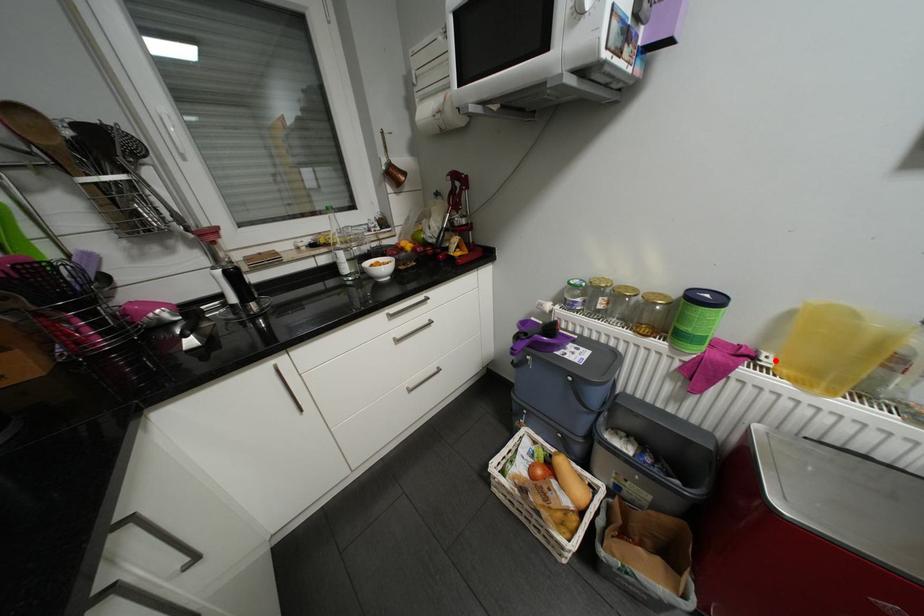
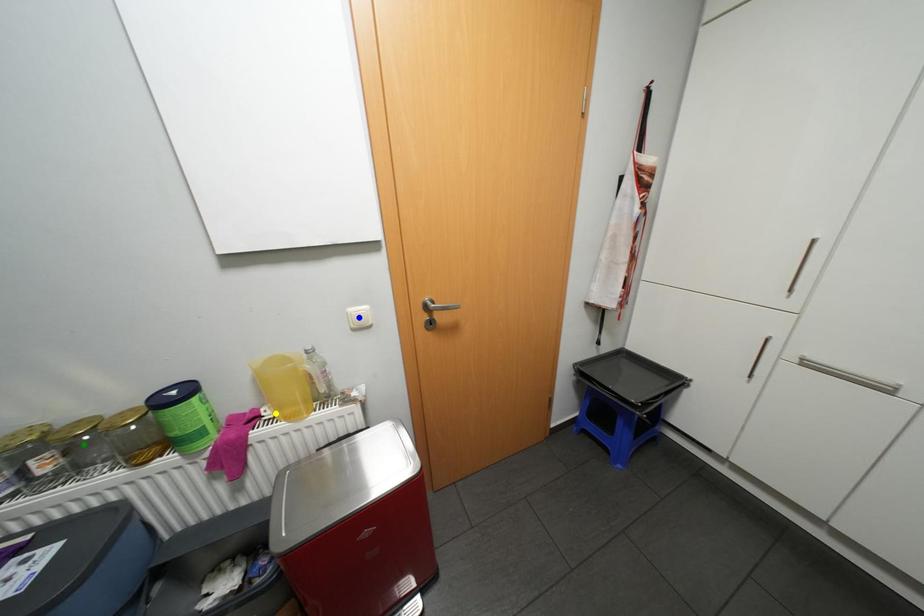
Question: I am providing you with two images of the same scene from different viewpoints. A red point is marked on the first image. You are given multiple points on the second image. Which point in image 2 is actually the same real-world point as the red point in image 1?

Choices:
 (A) green point
 (B) yellow point
 (C) blue point

Answer: (B)